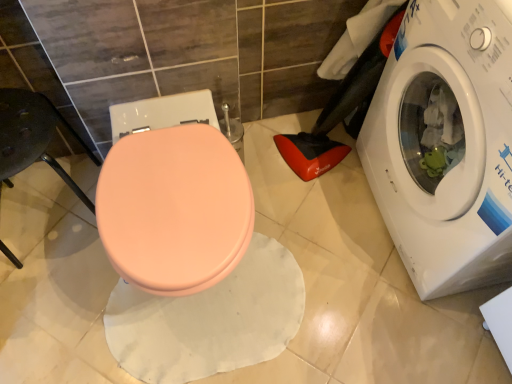
The height and width of the screenshot is (384, 512). I want to click on free space in front of white glossy washing machine at right, so click(408, 335).